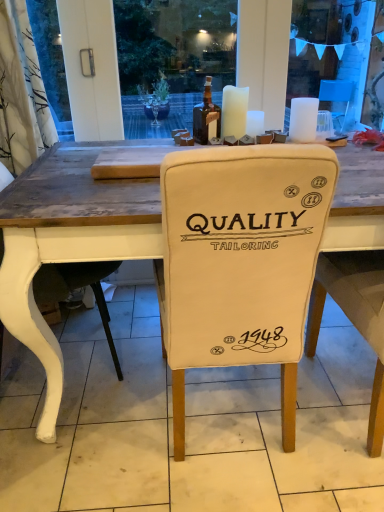
The width and height of the screenshot is (384, 512). I want to click on free space in front of white fabric chair at left, so click(x=70, y=454).